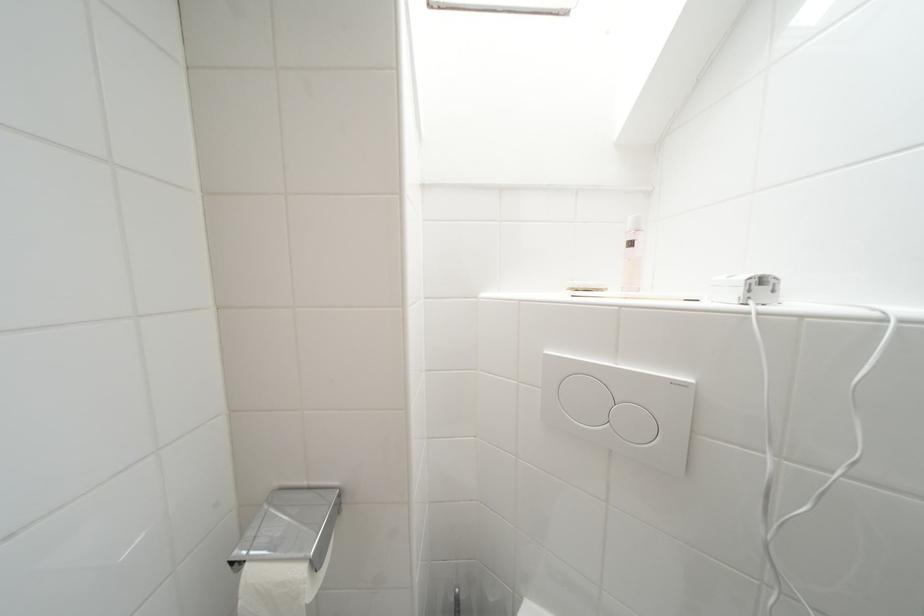
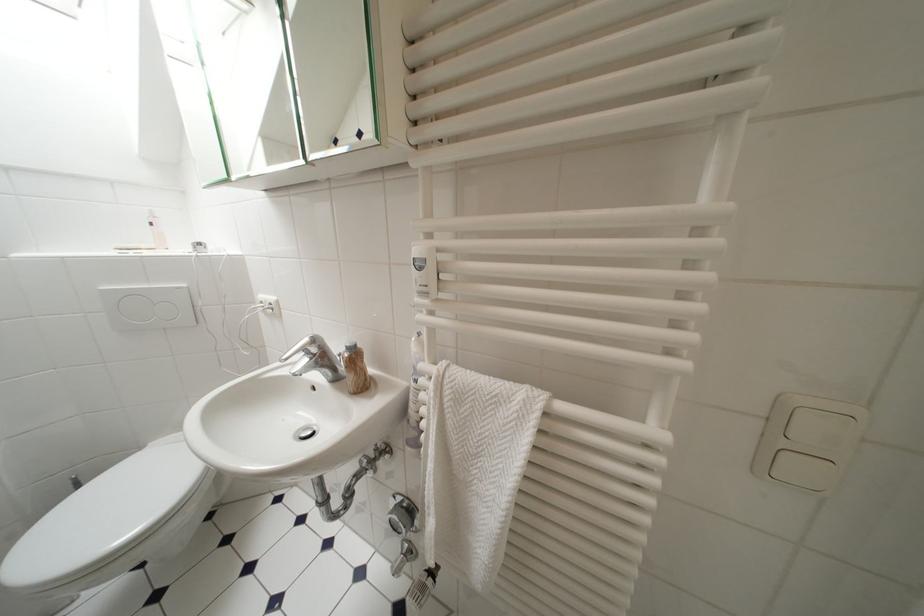
Where in the second image is the point corresponding to [681,387] from the first image?

(185, 291)